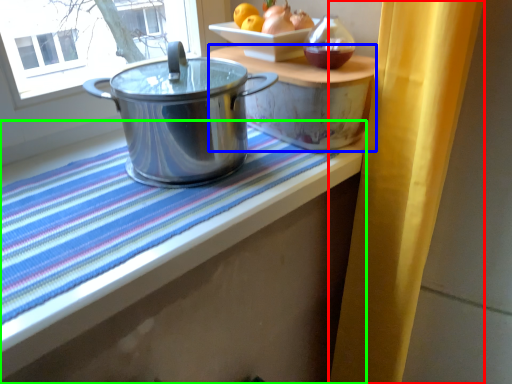
Question: Based on their relative distances, which object is nearer to curtain (highlighted by a red box)? Choose from table (highlighted by a blue box) and table (highlighted by a green box).

Choices:
 (A) table
 (B) table

Answer: (A)